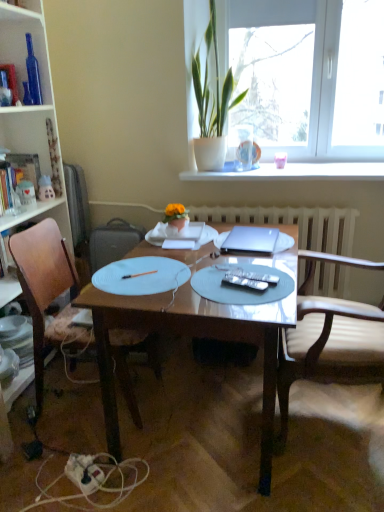
Find the location of a particular element. free space that is in between white matte paper plate at center, the first paper plate in the left-to-right sequence, and white paper notebook at center is located at coordinates (166, 254).